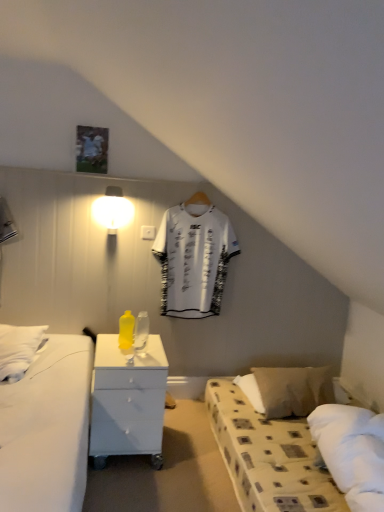
This screenshot has height=512, width=384. Find the location of `free space in front of transparent glass bottle at center, acting as the 1th bottle starting from the right`. free space in front of transparent glass bottle at center, acting as the 1th bottle starting from the right is located at coordinates (140, 356).